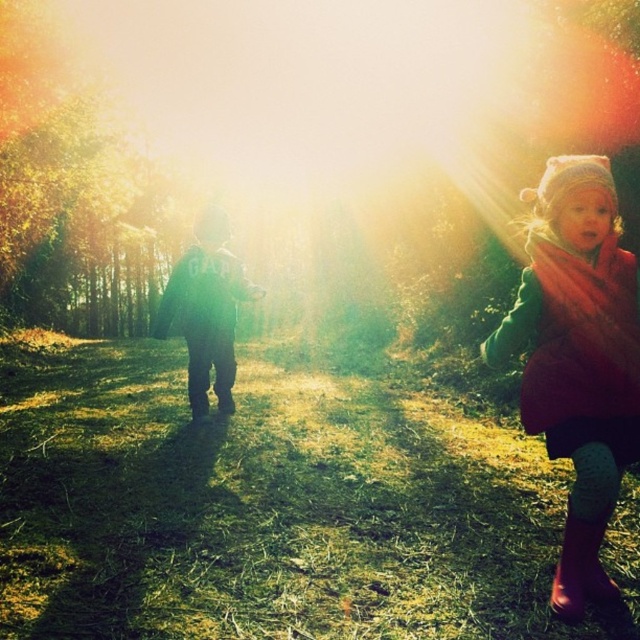
You are a photographer trying to capture a closeup shot of the knitted woolen hat at upper right and the rubber boots at lower right in the same frame. Given the camera you have can only focus on objects within a 6 inch range, will you be able to capture both in focus?

The distance between the knitted woolen hat at upper right and rubber boots at lower right is 6.67 inches, which exceeds the camera focus range of 6 inches. Therefore, you cannot capture both in focus simultaneously.

You are a photographer trying to capture a closeup of the knitted woolen hat at upper right and the rubber boots at lower right in the scene. Since the camera can only focus on one object at a time, which object should you prioritize to ensure it is in focus if you want both to be as clear as possible?

The knitted woolen hat at upper right is positioned on the left side of rubber boots at lower right, so you should prioritize focusing on the knitted woolen hat at upper right because it is closer to the camera than the rubber boots at lower right.